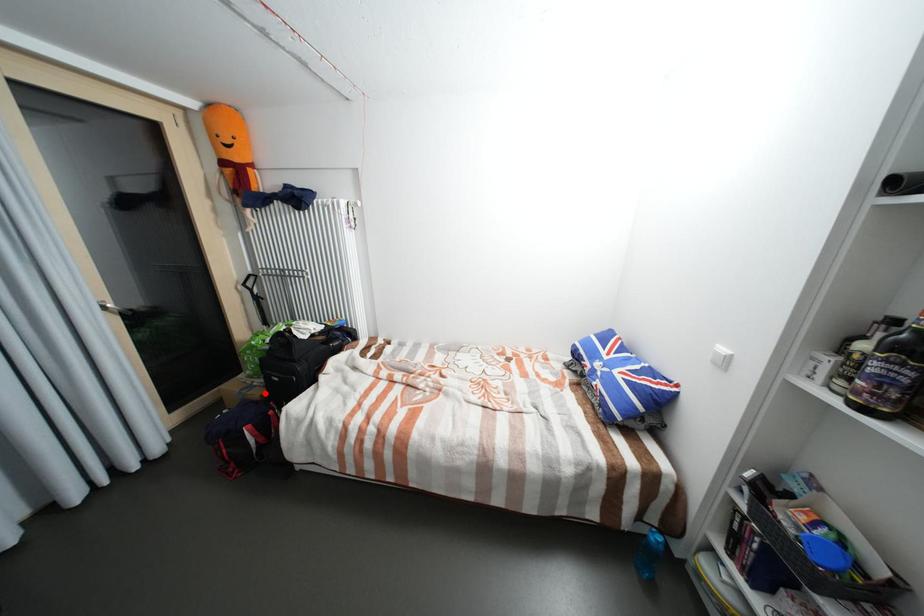
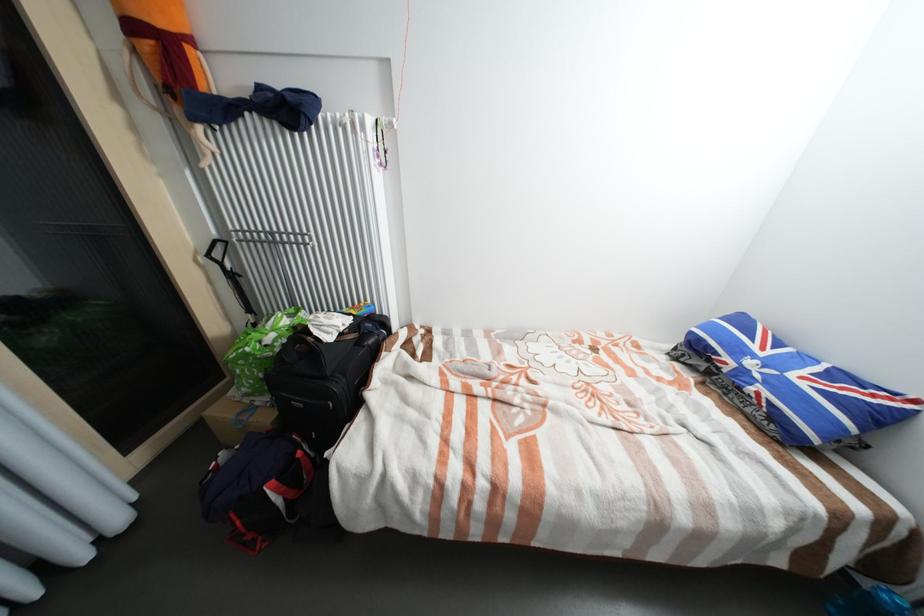
The point at the highlighted location is marked in the first image. Where is the corresponding point in the second image?

(273, 419)